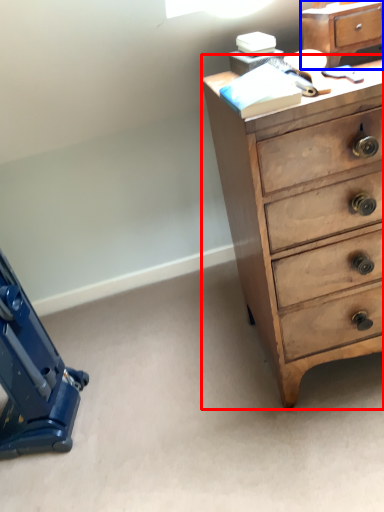
Question: Which object is further to the camera taking this photo, chest of drawers (highlighted by a red box) or file cabinet (highlighted by a blue box)?

Choices:
 (A) chest of drawers
 (B) file cabinet

Answer: (B)